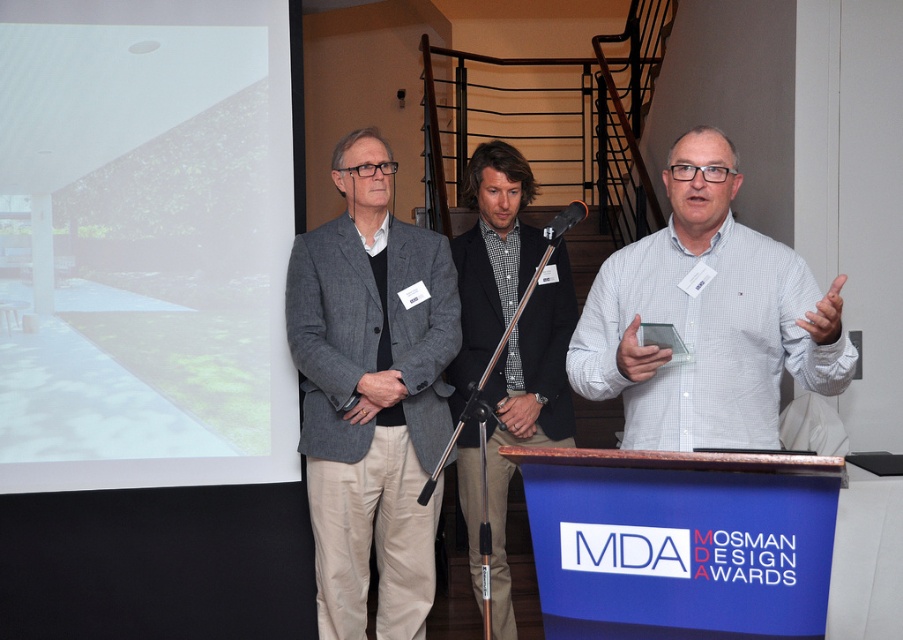
Is gray wool blazer at center in front of white checkered shirt at center?

No, gray wool blazer at center is further to the viewer.

Can you confirm if gray wool blazer at center is thinner than white checkered shirt at center?

Indeed, gray wool blazer at center has a lesser width compared to white checkered shirt at center.

At what (x,y) coordinates should I click in order to perform the action: click on gray wool blazer at center. Please return your answer as a coordinate pair (x, y). The image size is (903, 640). Looking at the image, I should click on (371, 394).

The height and width of the screenshot is (640, 903). In order to click on gray wool blazer at center in this screenshot , I will do `click(371, 394)`.

Is white checkered shirt at center bigger than checkered fabric shirt at center?

No, white checkered shirt at center is not bigger than checkered fabric shirt at center.

Based on the photo, is white checkered shirt at center closer to the viewer compared to checkered fabric shirt at center?

Yes, it is.

Does point (715, 419) come behind point (540, 413)?

No, (715, 419) is in front of (540, 413).

Locate an element on the screen. This screenshot has width=903, height=640. white checkered shirt at center is located at coordinates (706, 317).

Is gray wool blazer at center below checkered fabric shirt at center?

Actually, gray wool blazer at center is above checkered fabric shirt at center.

Find the location of a particular element. gray wool blazer at center is located at coordinates (371, 394).